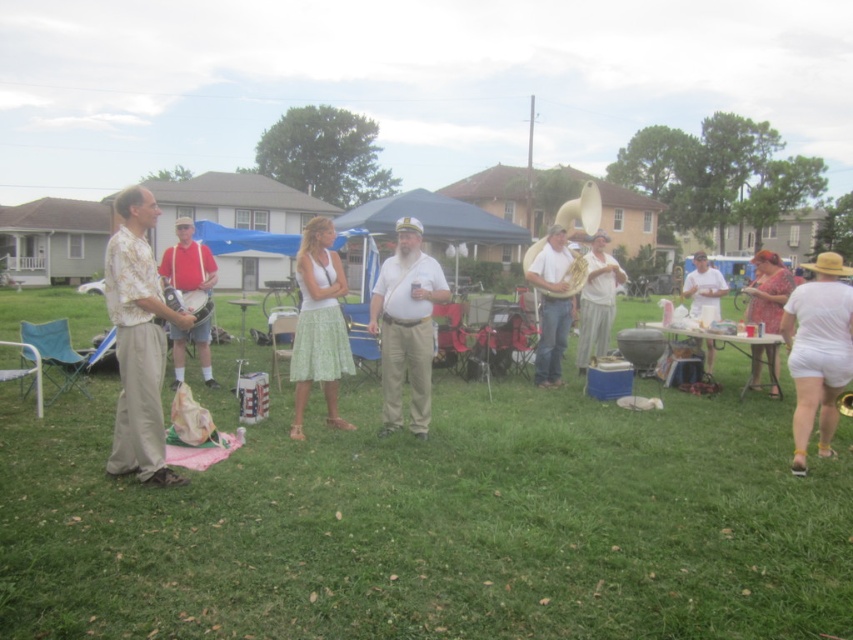
Is white cotton shirt at center below gold brass tuba at center?

No, white cotton shirt at center is not below gold brass tuba at center.

Between white cotton shirt at center and gold brass tuba at center, which one appears on the left side from the viewer's perspective?

Positioned to the left is gold brass tuba at center.

Does point (705, 342) come behind point (572, 280)?

Yes, it is.

Where is `white cotton shirt at center`? white cotton shirt at center is located at coordinates pyautogui.click(x=703, y=285).

This screenshot has width=853, height=640. I want to click on floral print shirt at left, so click(138, 340).

Can you confirm if floral print shirt at left is positioned above white matte shirt at center?

Yes.

Between point (126, 429) and point (416, 250), which one is positioned behind?

Point (416, 250)

You are a GUI agent. You are given a task and a screenshot of the screen. Output one action in this format:
    pyautogui.click(x=<x>, y=<y>)
    Task: Click on the floral print shirt at left
    The width and height of the screenshot is (853, 640).
    Given the screenshot: What is the action you would take?
    pyautogui.click(x=138, y=340)

Who is more distant from viewer, (x=821, y=436) or (x=781, y=305)?

The point (x=781, y=305) is more distant.

Does white cotton shorts at right have a greater width compared to floral dress at right?

Correct, the width of white cotton shorts at right exceeds that of floral dress at right.

This screenshot has height=640, width=853. What do you see at coordinates (817, 353) in the screenshot? I see `white cotton shorts at right` at bounding box center [817, 353].

Find the location of a particular element. This screenshot has width=853, height=640. white cotton shorts at right is located at coordinates (817, 353).